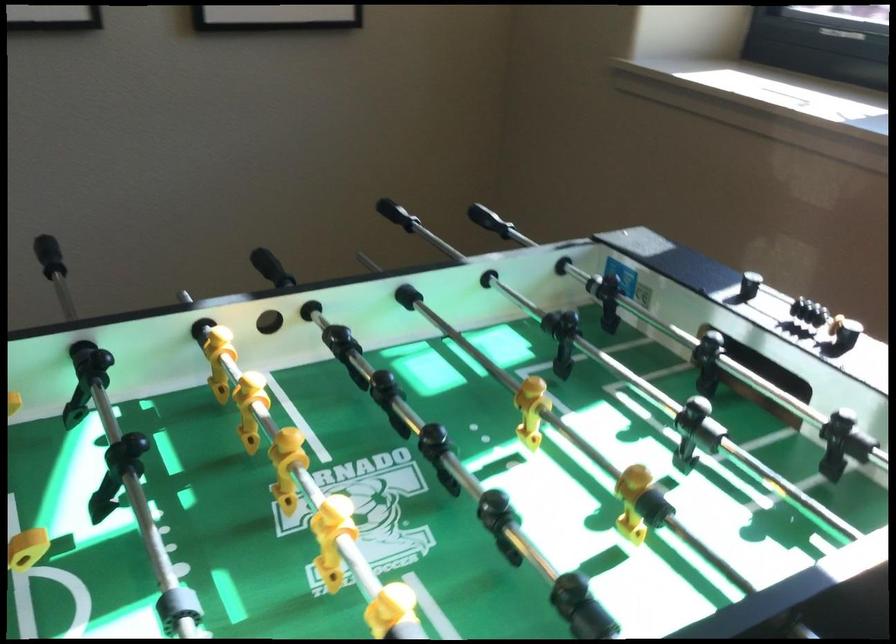
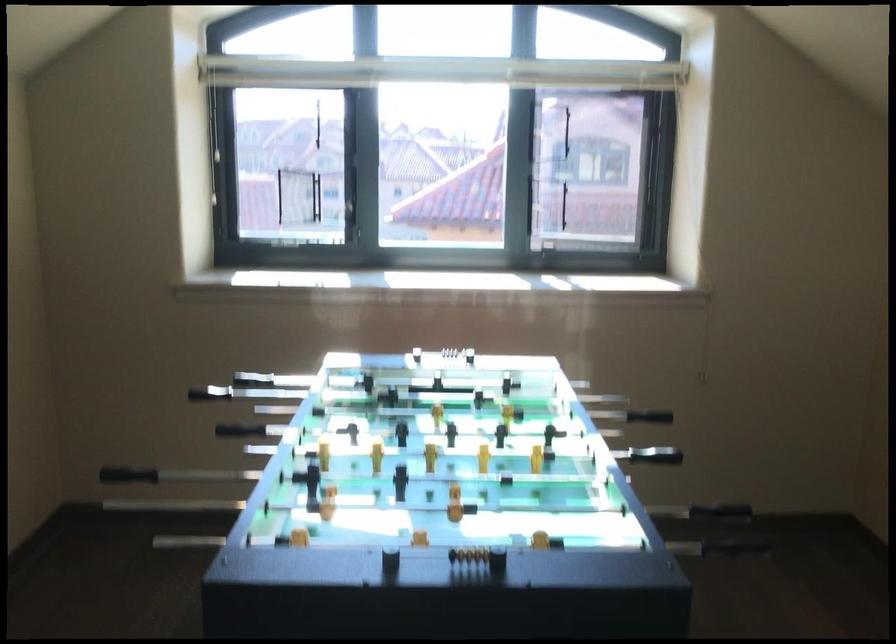
The point at [819,315] is marked in the first image. Where is the corresponding point in the second image?

(442, 353)